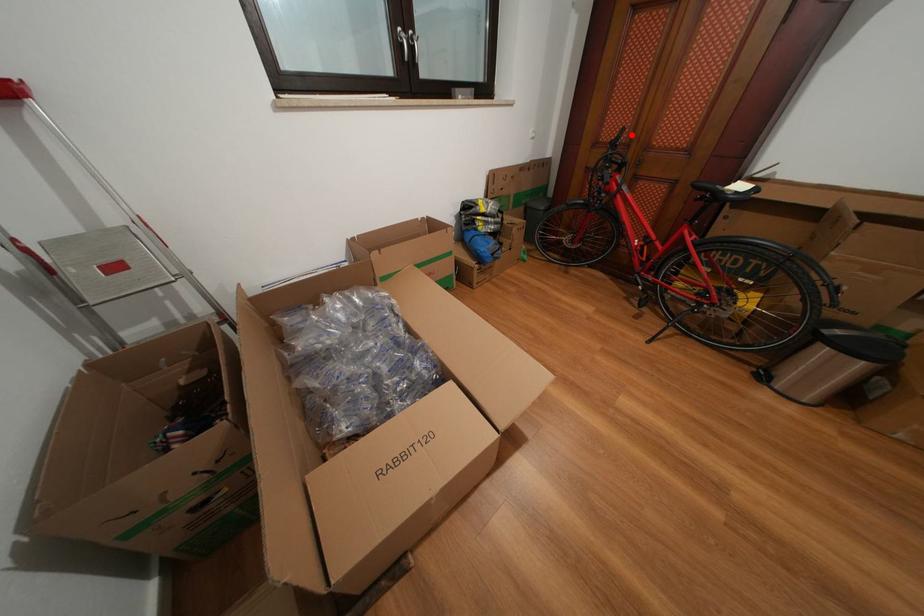
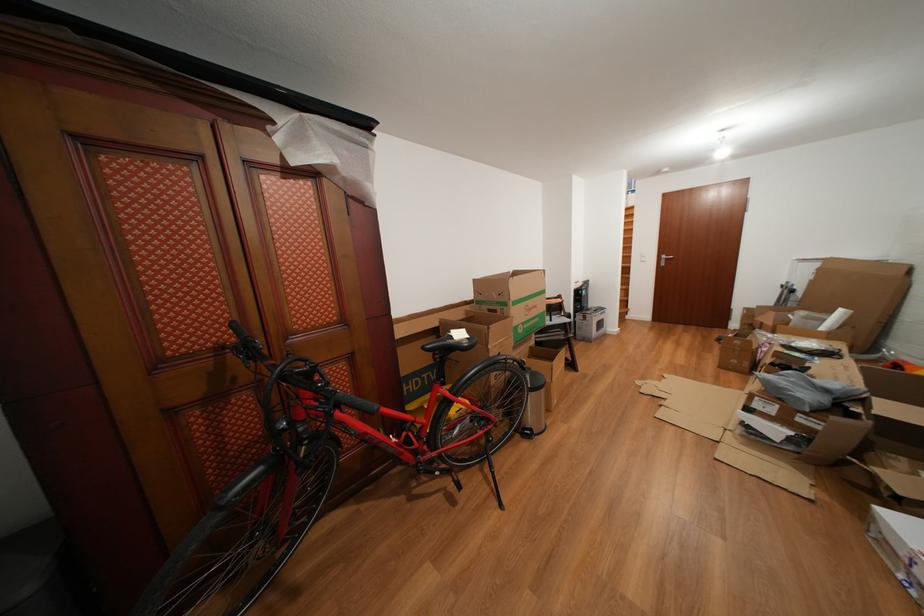
The point at the highlighted location is marked in the first image. Where is the corresponding point in the second image?

(241, 330)